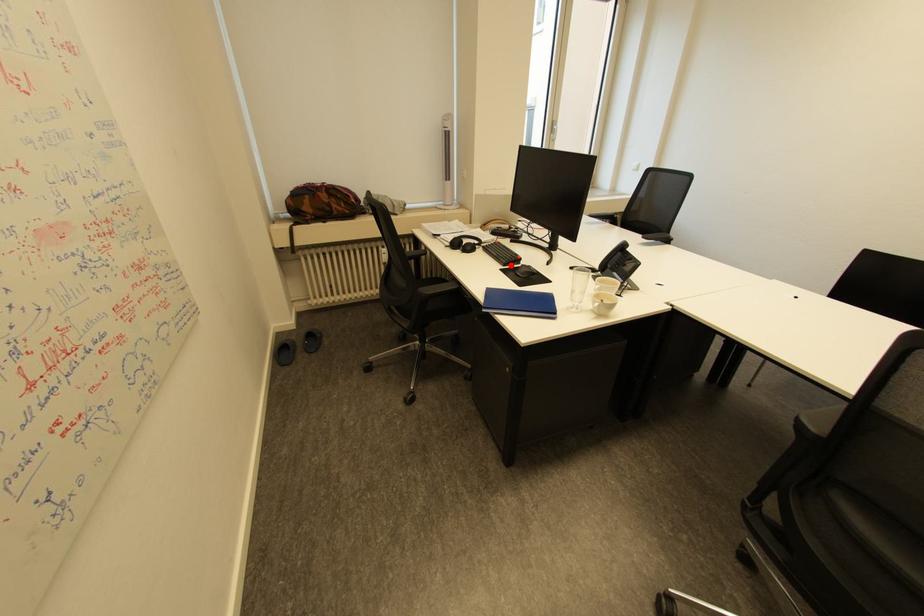
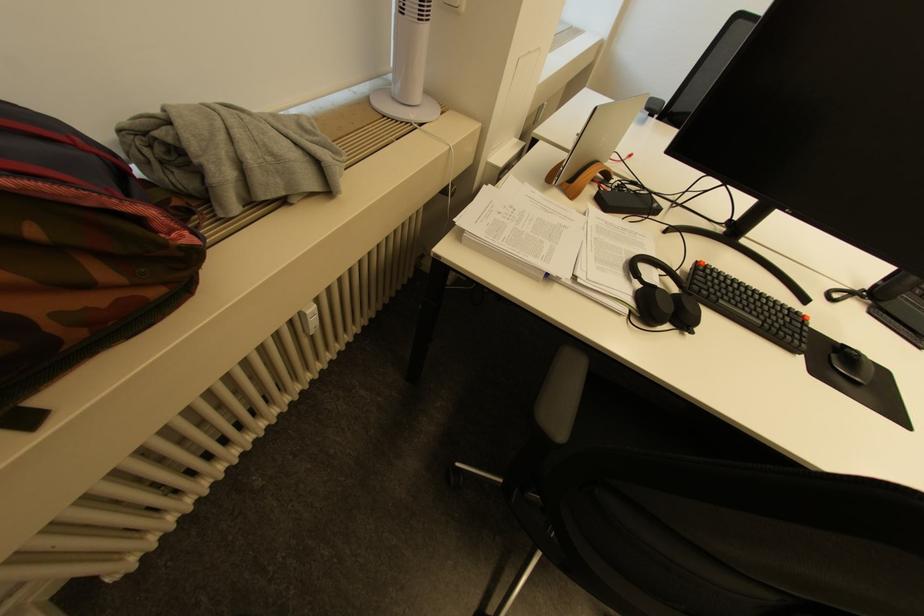
Question: I am providing you with two images of the same scene from different viewpoints. A red point is marked on the first image. Is the red point's position out of view in image 2?

Choices:
 (A) Yes
 (B) No

Answer: (B)